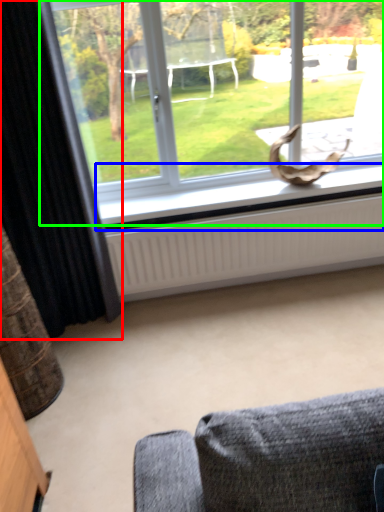
Question: Which object is positioned closest to curtain (highlighted by a red box)? Select from window sill (highlighted by a blue box) and window (highlighted by a green box).

Choices:
 (A) window sill
 (B) window

Answer: (A)